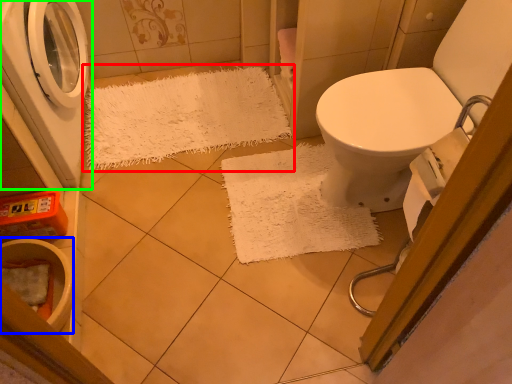
Question: Which object is positioned farthest from doormat (highlighted by a red box)? Select from toilet bowl (highlighted by a blue box) and washing machine (highlighted by a green box).

Choices:
 (A) toilet bowl
 (B) washing machine

Answer: (A)